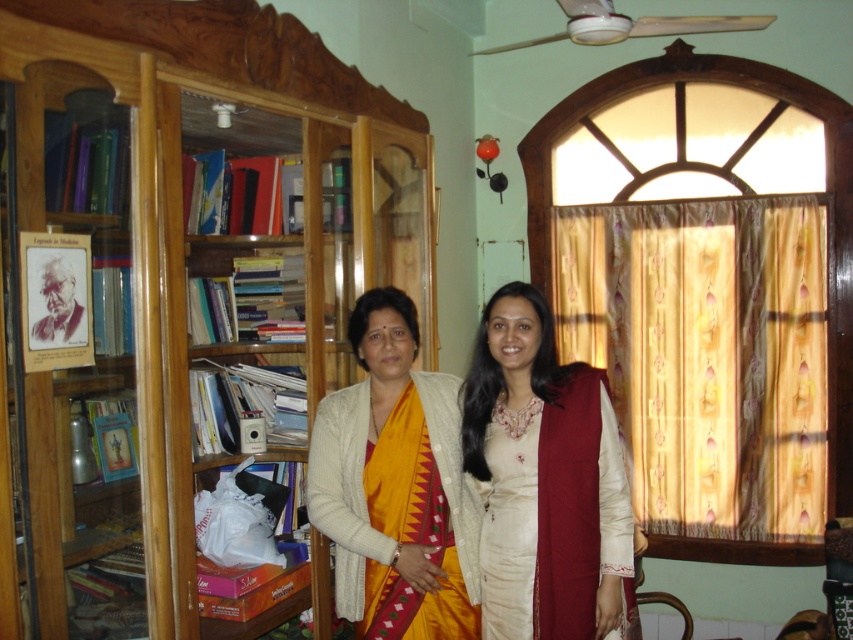
Question: Observing the image, what is the correct spatial positioning of yellow silk saree at center in reference to wooden bookshelf at left?

Choices:
 (A) below
 (B) above

Answer: (A)

Question: Can you confirm if yellow silk saree at center is thinner than wooden bookshelf at left?

Choices:
 (A) yes
 (B) no

Answer: (A)

Question: Which object appears farthest from the camera in this image?

Choices:
 (A) beige satin kurta with maroon dupatta at center
 (B) wooden bookshelf at left

Answer: (A)

Question: Does beige satin kurta with maroon dupatta at center come behind wooden bookshelf at left?

Choices:
 (A) no
 (B) yes

Answer: (B)

Question: Which point appears farthest from the camera in this image?

Choices:
 (A) (178, 394)
 (B) (566, 374)

Answer: (B)

Question: Estimate the real-world distances between objects in this image. Which object is farther from the beige satin kurta with maroon dupatta at center?

Choices:
 (A) wooden bookshelf at left
 (B) yellow silk saree at center

Answer: (A)